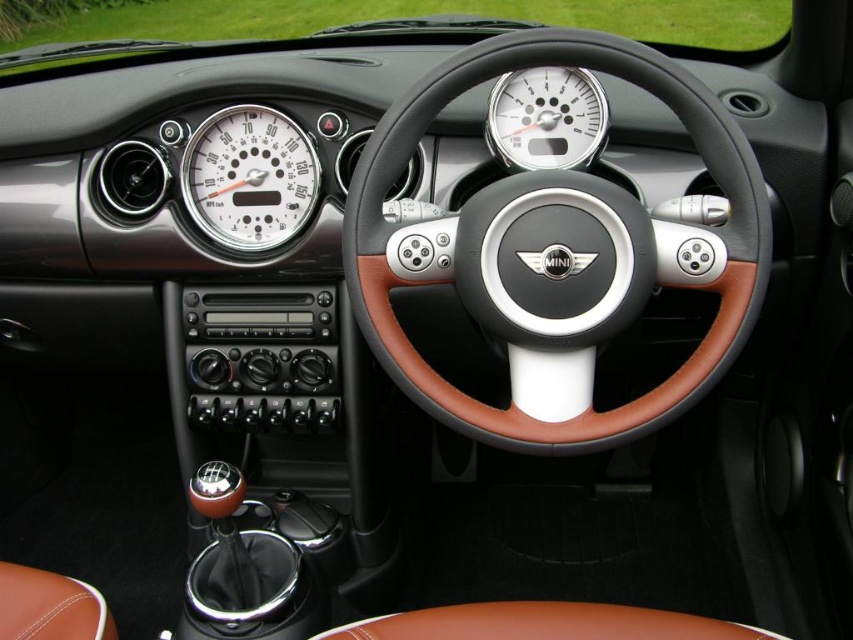
You are sitting in the driver seat of the Mini Cooper car. You notice a point on the dashboard at coordinates (248, 177). What object is located at that point?

The point at coordinates (248, 177) corresponds to the white glossy speedometer at center.

You are a car mechanic inspecting the Mini Cooper dashboard. Where is the white glossy speedometer at center located in terms of coordinates?

The white glossy speedometer at center is located at point coordinates of (x=248, y=177).